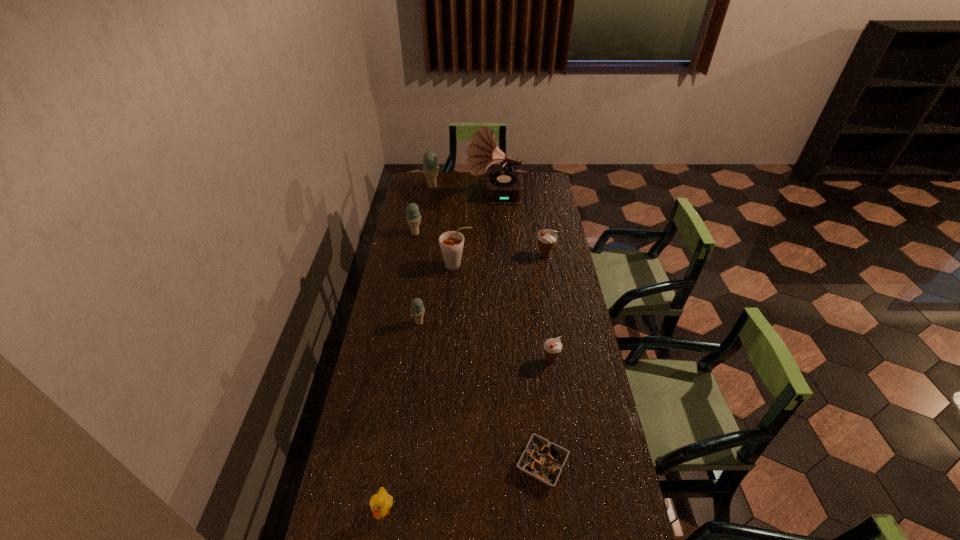
The width and height of the screenshot is (960, 540). I want to click on free space located on the front of the farthest blue ice cream, so click(427, 217).

In order to click on vacant space situated 0.270m on the drink side of the root beer in this screenshot , I will do `click(533, 266)`.

This screenshot has height=540, width=960. Identify the location of vacant space located 0.080m on the back of the third nearest ice cream. (542, 239).

Find the location of a particular element. This screenshot has width=960, height=540. free space located 0.110m on the front of the second biggest blue ice cream is located at coordinates (412, 252).

Where is `vacant space located on the back of the nearest ice cream`? Image resolution: width=960 pixels, height=540 pixels. vacant space located on the back of the nearest ice cream is located at coordinates (539, 281).

The image size is (960, 540). Identify the location of free location located 0.400m on the back of the nearest blue ice cream. (429, 254).

Locate an element on the screen. vacant space located on the left of the ashtray is located at coordinates (465, 464).

Where is `record player that is at the far edge`? record player that is at the far edge is located at coordinates (504, 187).

Identify the location of ice cream that is positioned at the far edge. (430, 168).

Where is `duckling that is at the left edge`? The width and height of the screenshot is (960, 540). duckling that is at the left edge is located at coordinates (380, 503).